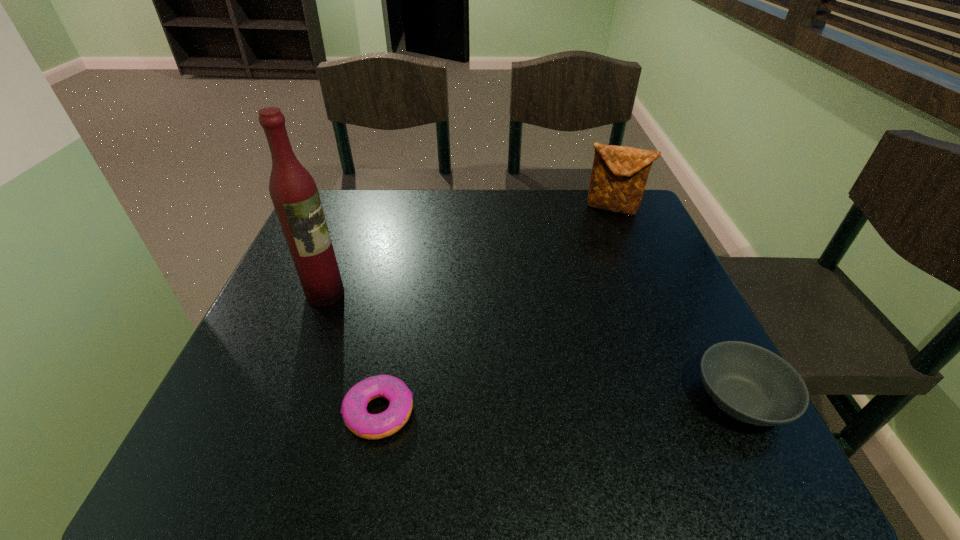
At what (x,y) coordinates should I click in order to perform the action: click on vacant space in between the soup bowl and the doughnut. Please return your answer as a coordinate pair (x, y). The height and width of the screenshot is (540, 960). Looking at the image, I should click on (560, 406).

You are a GUI agent. You are given a task and a screenshot of the screen. Output one action in this format:
    pyautogui.click(x=<x>, y=<y>)
    Task: Click on the empty location between the soup bowl and the tallest object
    The width and height of the screenshot is (960, 540).
    Given the screenshot: What is the action you would take?
    pyautogui.click(x=533, y=347)

The image size is (960, 540). I want to click on free area in between the second tallest object and the soup bowl, so click(x=676, y=303).

The image size is (960, 540). I want to click on free space between the second farthest object and the soup bowl, so click(x=533, y=347).

Where is `vacant space that is in between the third object from right to left and the leftmost object`? vacant space that is in between the third object from right to left and the leftmost object is located at coordinates (352, 353).

This screenshot has height=540, width=960. In order to click on free spot between the farthest object and the third tallest object in this screenshot , I will do `click(676, 303)`.

Identify the location of free space between the second object from left to right and the tallest object. Image resolution: width=960 pixels, height=540 pixels. (352, 353).

You are a GUI agent. You are given a task and a screenshot of the screen. Output one action in this format:
    pyautogui.click(x=<x>, y=<y>)
    Task: Click on the free space between the tallest object and the shortest object
    
    Given the screenshot: What is the action you would take?
    pyautogui.click(x=352, y=353)

I want to click on vacant point located between the second shortest object and the shortest object, so click(x=560, y=406).

Locate which object is the second closest to the third tallest object. Please provide its 2D coordinates. Your answer should be formatted as a tuple, i.e. [(x, y)], where the tuple contains the x and y coordinates of a point satisfying the conditions above.

[(619, 175)]